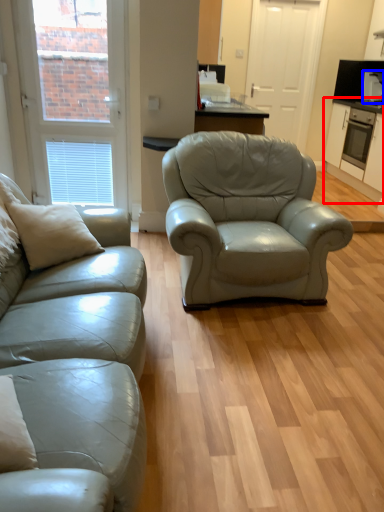
Question: Which point is closer to the camera, cabinetry (highlighted by a red box) or appliance (highlighted by a blue box)?

Choices:
 (A) cabinetry
 (B) appliance

Answer: (A)